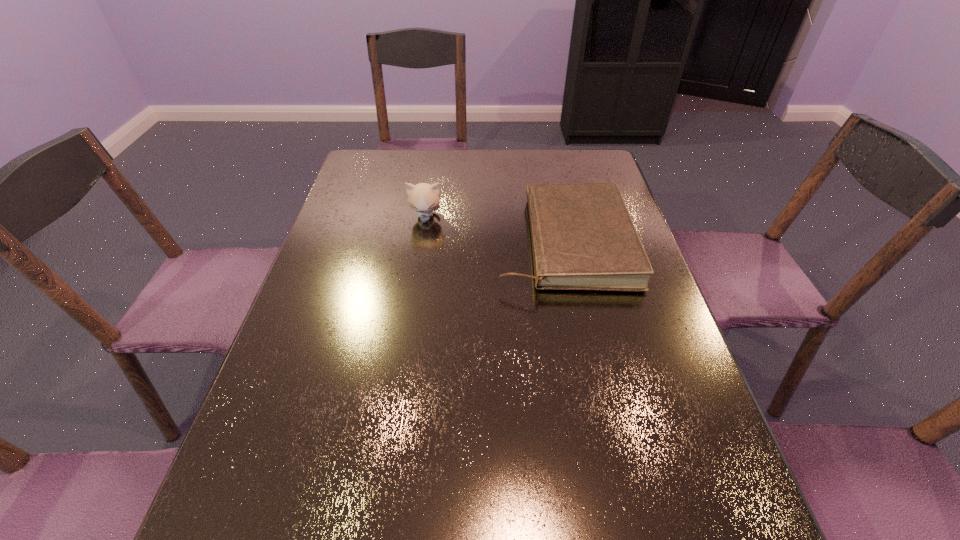
Identify the location of vacant space at the left edge. (336, 293).

You are a GUI agent. You are given a task and a screenshot of the screen. Output one action in this format:
    pyautogui.click(x=<x>, y=<y>)
    Task: Click on the free space at the right edge of the desktop
    This screenshot has height=540, width=960.
    Given the screenshot: What is the action you would take?
    pyautogui.click(x=626, y=316)

In the image, there is a desktop. Identify the location of vacant space at the far left corner. (383, 156).

The width and height of the screenshot is (960, 540). I want to click on vacant space at the far right corner, so click(598, 181).

Identify the location of free space at the near right corner of the desktop. The width and height of the screenshot is (960, 540). [x=668, y=532].